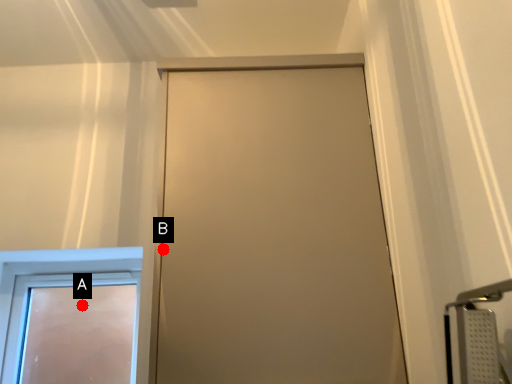
Question: Two points are circled on the image, labeled by A and B beside each circle. Which point appears closest to the camera in this image?

Choices:
 (A) A is closer
 (B) B is closer

Answer: (B)